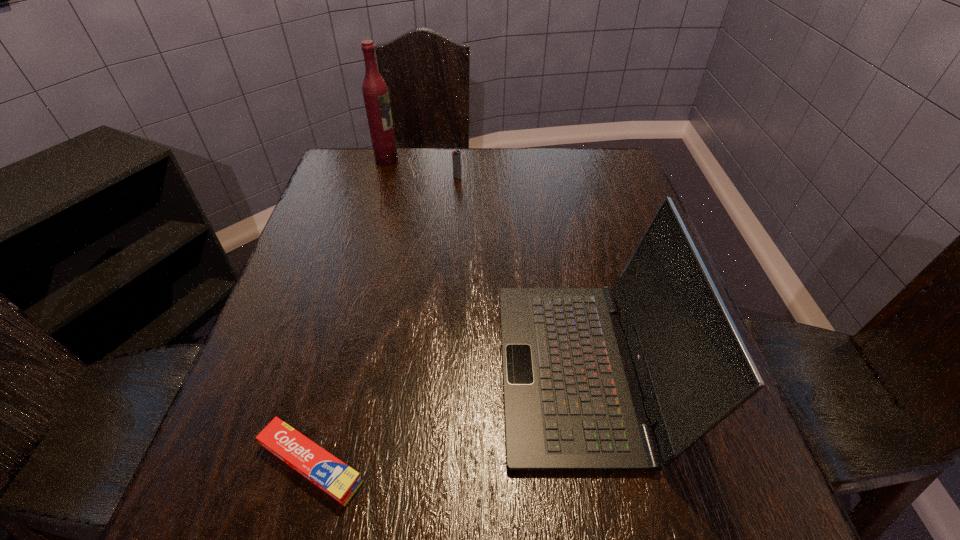
Locate an element on the screen. The height and width of the screenshot is (540, 960). free space between the laptop computer and the farthest object is located at coordinates (484, 265).

What are the coordinates of `empty location between the igniter and the liquor` in the screenshot? It's located at (422, 168).

Locate an element on the screen. free space between the laptop computer and the farthest object is located at coordinates (484, 265).

Identify the location of empty space between the laptop computer and the third tallest object. (518, 273).

You are a GUI agent. You are given a task and a screenshot of the screen. Output one action in this format:
    pyautogui.click(x=<x>, y=<y>)
    Task: Click on the vacant space in between the second object from right to left and the liquor
    The image size is (960, 540).
    Given the screenshot: What is the action you would take?
    pyautogui.click(x=422, y=168)

You are a GUI agent. You are given a task and a screenshot of the screen. Output one action in this format:
    pyautogui.click(x=<x>, y=<y>)
    Task: Click on the free space between the toothpaste and the liquor
    This screenshot has height=540, width=960.
    Given the screenshot: What is the action you would take?
    pyautogui.click(x=349, y=312)

Where is `unoccupied area between the second shortest object and the farthest object`? unoccupied area between the second shortest object and the farthest object is located at coordinates (422, 168).

Where is `free space between the third nearest object and the toothpaste`? Image resolution: width=960 pixels, height=540 pixels. free space between the third nearest object and the toothpaste is located at coordinates (384, 320).

At what (x,y) coordinates should I click in order to perform the action: click on free space between the toothpaste and the tallest object. Please return your answer as a coordinate pair (x, y). The image size is (960, 540). Looking at the image, I should click on (349, 312).

Locate an element on the screen. This screenshot has width=960, height=540. object that is the closest to the toothpaste is located at coordinates (572, 402).